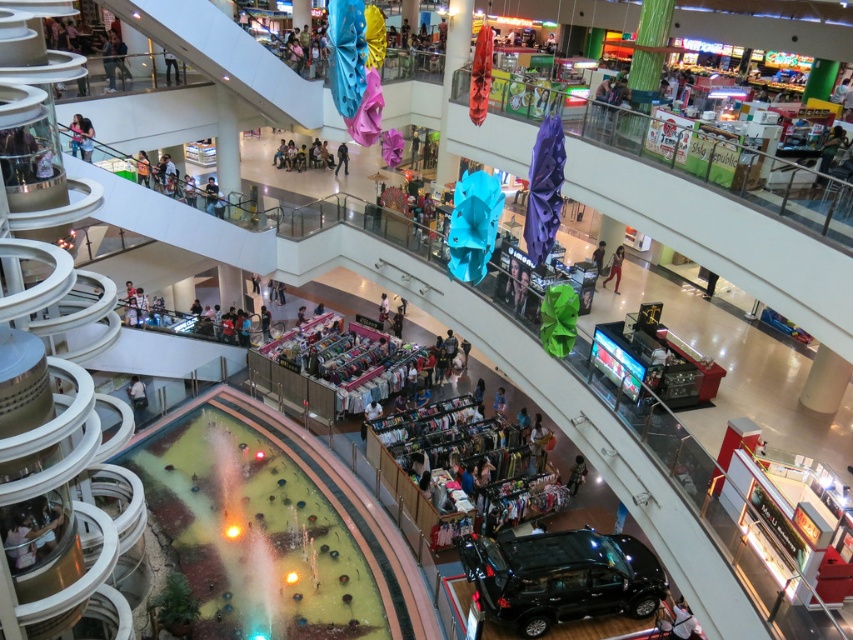
Between translucent glass fountain at center and skinny jeans at center, which one has less height?

skinny jeans at center is shorter.

Is translucent glass fountain at center behind skinny jeans at center?

No, it is in front of skinny jeans at center.

Which is behind, point (293, 589) or point (616, 266)?

Positioned behind is point (616, 266).

Locate an element on the screen. Image resolution: width=853 pixels, height=640 pixels. translucent glass fountain at center is located at coordinates (267, 531).

Is translucent glass fountain at center in front of matte black jacket at center?

Yes, translucent glass fountain at center is in front of matte black jacket at center.

Does translucent glass fountain at center appear on the left side of matte black jacket at center?

Yes, translucent glass fountain at center is to the left of matte black jacket at center.

Is point (187, 420) closer to camera compared to point (338, 170)?

Yes, point (187, 420) is closer to viewer.

The width and height of the screenshot is (853, 640). What are the coordinates of `translucent glass fountain at center` in the screenshot? It's located at (267, 531).

Can you confirm if matte black clothing at center is thinner than skinny jeans at center?

No.

Who is more distant from viewer, [281,161] or [607,276]?

The point [281,161] is more distant.

Where is `matte black clothing at center`? matte black clothing at center is located at coordinates (303, 156).